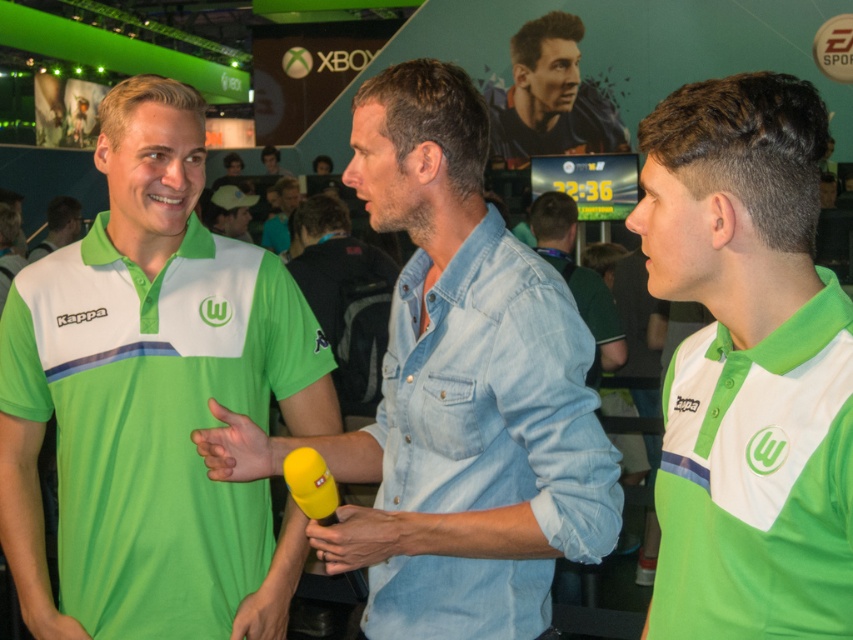
Question: Does green matte jersey at center appear on the right side of dark blue jersey at upper center?

Choices:
 (A) no
 (B) yes

Answer: (A)

Question: Is green fabric polo shirt at center closer to the viewer compared to light blue denim shirt at center?

Choices:
 (A) no
 (B) yes

Answer: (A)

Question: Is light blue denim shirt at center wider than white matte baseball cap at center?

Choices:
 (A) yes
 (B) no

Answer: (B)

Question: Which of these objects is positioned farthest from the green matte jersey at center?

Choices:
 (A) light blue denim shirt at center
 (B) white matte baseball cap at center

Answer: (B)

Question: Among these points, which one is farthest from the camera?

Choices:
 (A) (492, 120)
 (B) (418, 412)
 (C) (236, 218)

Answer: (A)

Question: Which is farther from the dark blue jersey at upper center?

Choices:
 (A) light blue denim shirt at center
 (B) denim shirt at center
 (C) green fabric polo shirt at center
 (D) green matte jersey at center

Answer: (D)